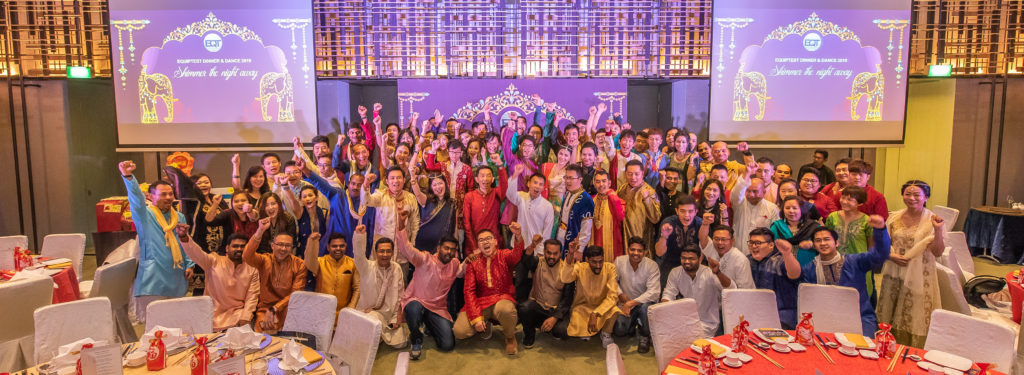
Locate an element on the screen. Image resolution: width=1024 pixels, height=375 pixels. projector screens is located at coordinates (215, 70), (836, 105).